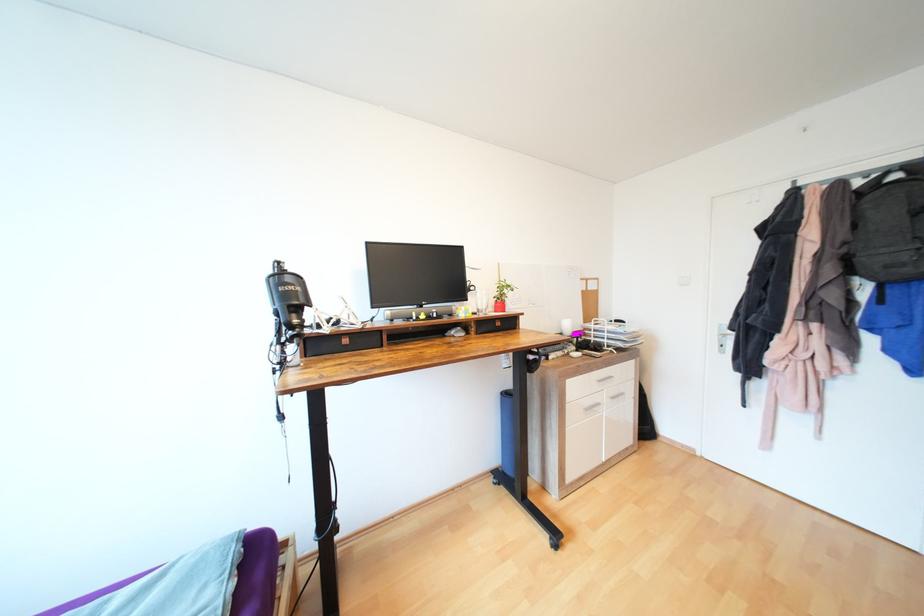
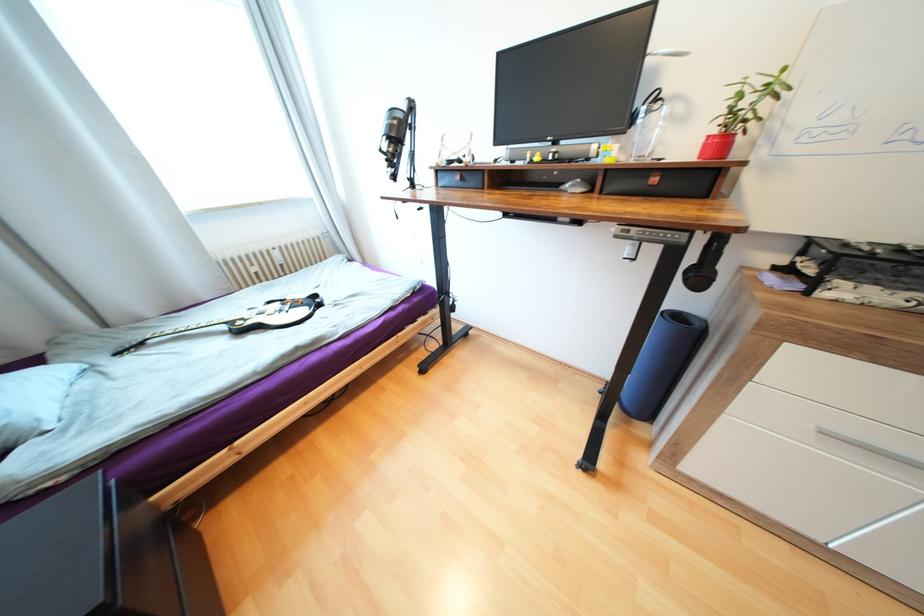
In the second image, find the point that corresponds to point (592, 410) in the first image.

(830, 432)